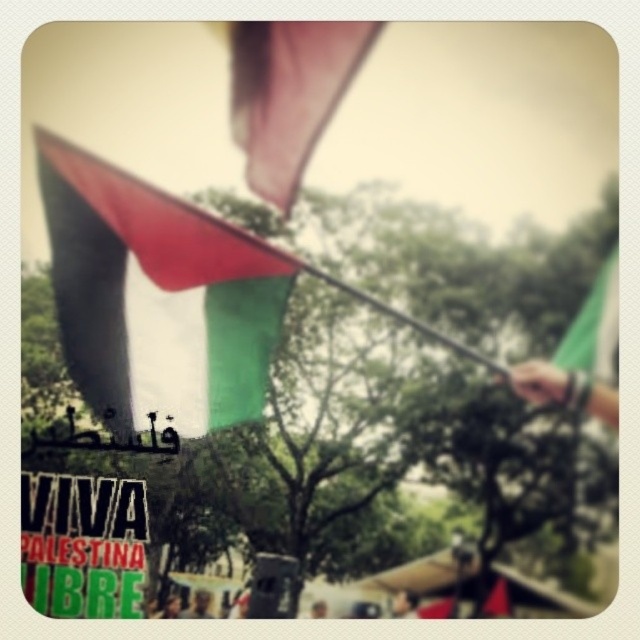
Which is behind, point (284, 170) or point (589, 292)?

The point (284, 170) is more distant.

Is point (340, 51) more distant than point (566, 332)?

Yes, point (340, 51) is behind point (566, 332).

Where is `silky pink fabric at upper center`? The height and width of the screenshot is (640, 640). silky pink fabric at upper center is located at coordinates (289, 93).

Between point (188, 413) and point (616, 317), which one is positioned in front?

Point (616, 317) is in front.

Consider the image. Is tri-color fabric flag at center bigger than green fabric flag at upper right?

Yes.

The image size is (640, 640). In order to click on tri-color fabric flag at center in this screenshot , I will do `click(156, 298)`.

Is point (108, 221) positioned after point (316, 140)?

Yes, point (108, 221) is behind point (316, 140).

Is tri-color fabric flag at center positioned at the back of silky pink fabric at upper center?

Yes, it is.

Between point (180, 426) and point (244, 67), which one is positioned in front?

Positioned in front is point (244, 67).

At what (x,y) coordinates should I click in order to perform the action: click on tri-color fabric flag at center. Please return your answer as a coordinate pair (x, y). The image size is (640, 640). Looking at the image, I should click on tap(156, 298).